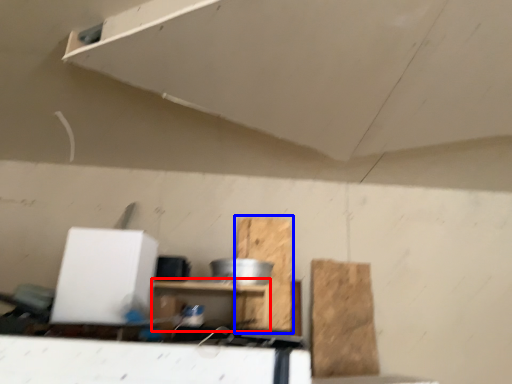
Question: Which object is further to the camera taking this photo, furniture (highlighted by a red box) or cardboard (highlighted by a blue box)?

Choices:
 (A) furniture
 (B) cardboard

Answer: (B)